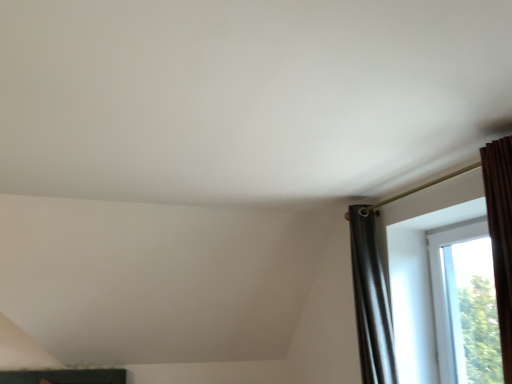
Question: Is transparent glass window at right, the 2th window in the left-to-right sequence, taller or shorter than transparent glass window at right, which ranks as the 2th window in right-to-left order?

Choices:
 (A) tall
 (B) short

Answer: (B)

Question: From a real-world perspective, is transparent glass window at right, the 2th window in the left-to-right sequence, positioned above or below transparent glass window at right, which ranks as the 2th window in right-to-left order?

Choices:
 (A) below
 (B) above

Answer: (A)

Question: In terms of size, does transparent glass window at right, the 1th window when ordered from right to left, appear bigger or smaller than transparent glass window at right, which appears as the 1th window when viewed from the left?

Choices:
 (A) big
 (B) small

Answer: (B)

Question: Considering the positions of transparent glass window at right, which appears as the 1th window when viewed from the left, and transparent glass window at right, the 2th window in the left-to-right sequence, in the image, is transparent glass window at right, which appears as the 1th window when viewed from the left, bigger or smaller than transparent glass window at right, the 2th window in the left-to-right sequence,?

Choices:
 (A) big
 (B) small

Answer: (A)

Question: Do you think transparent glass window at right, which appears as the 1th window when viewed from the left, is within transparent glass window at right, the 1th window when ordered from right to left, or outside of it?

Choices:
 (A) outside
 (B) inside

Answer: (A)

Question: From a real-world perspective, relative to transparent glass window at right, the 2th window in the left-to-right sequence, is transparent glass window at right, which ranks as the 2th window in right-to-left order, vertically above or below?

Choices:
 (A) above
 (B) below

Answer: (A)

Question: From the image's perspective, relative to transparent glass window at right, the 1th window when ordered from right to left, is transparent glass window at right, which appears as the 1th window when viewed from the left, above or below?

Choices:
 (A) above
 (B) below

Answer: (A)